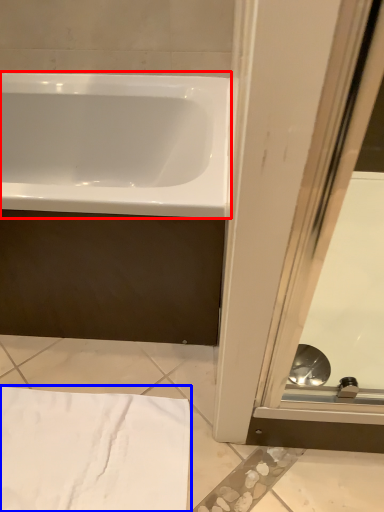
Question: Among these objects, which one is nearest to the camera, bathtub (highlighted by a red box) or bath towel (highlighted by a blue box)?

Choices:
 (A) bathtub
 (B) bath towel

Answer: (A)